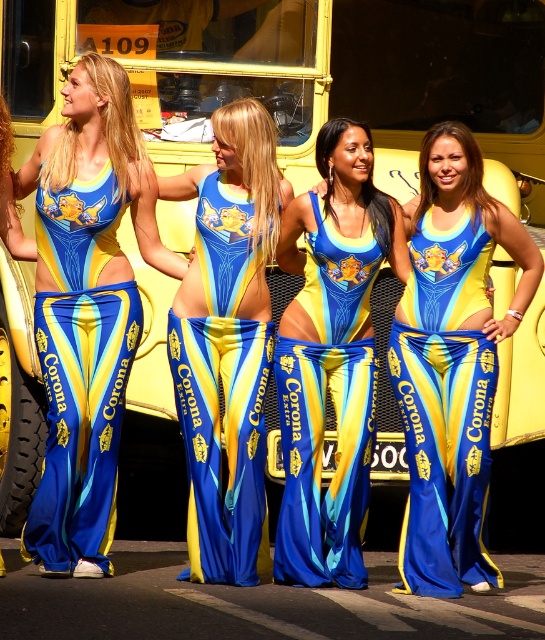
Can you confirm if matte blue fabric bikini at left is shorter than shiny blue fabric dress at center?

In fact, matte blue fabric bikini at left may be taller than shiny blue fabric dress at center.

Who is more forward, (117,160) or (327,330)?

Point (117,160)

Does point (51, 429) come in front of point (287, 396)?

Yes, point (51, 429) is closer to viewer.

The image size is (545, 640). I want to click on matte blue fabric bikini at left, so click(87, 308).

Who is lower down, matte blue fabric bikini at left or blue satin pants at center?

matte blue fabric bikini at left is lower down.

Which is more to the left, matte blue fabric bikini at left or blue satin pants at center?

blue satin pants at center is more to the left.

Where is `matte blue fabric bikini at left`? matte blue fabric bikini at left is located at coordinates (87, 308).

Is shiny blue fabric bikini at center shorter than matte blue fabric bikini at center?

Correct, shiny blue fabric bikini at center is not as tall as matte blue fabric bikini at center.

Is point (492, 397) closer to viewer compared to point (186, 356)?

Yes, it is.

This screenshot has height=640, width=545. I want to click on shiny blue fabric bikini at center, so click(451, 362).

Find the location of a particular element. This screenshot has height=640, width=545. shiny blue fabric bikini at center is located at coordinates (451, 362).